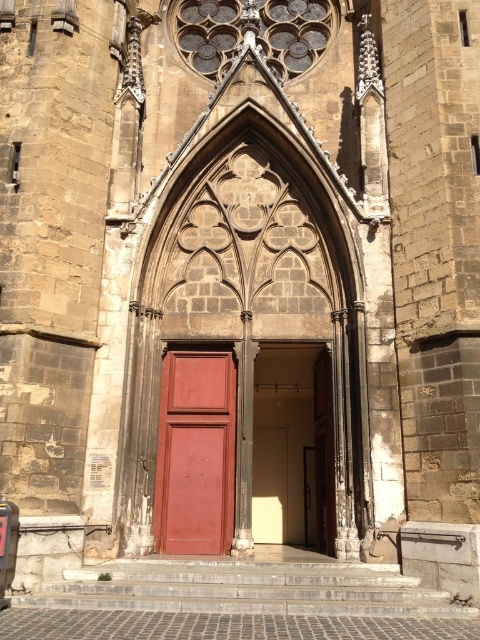
Can you confirm if gray stone stairs at lower center is positioned above matte wood door at center?

No, gray stone stairs at lower center is not above matte wood door at center.

The width and height of the screenshot is (480, 640). In order to click on gray stone stairs at lower center in this screenshot , I will do `click(244, 588)`.

Image resolution: width=480 pixels, height=640 pixels. Find the location of `gray stone stairs at lower center`. gray stone stairs at lower center is located at coordinates (244, 588).

Who is taller, smooth cream door at center or matte wood door at center?

smooth cream door at center

Does point (332, 518) lie behind point (183, 461)?

No, (332, 518) is closer to viewer.

Is point (311, 371) more distant than point (218, 424)?

Yes, it is behind point (218, 424).

The width and height of the screenshot is (480, 640). I want to click on smooth cream door at center, so click(294, 448).

Can you confirm if gray stone stairs at lower center is positioned to the left of smooth cream door at center?

Correct, you'll find gray stone stairs at lower center to the left of smooth cream door at center.

Which is above, gray stone stairs at lower center or smooth cream door at center?

Positioned higher is smooth cream door at center.

The width and height of the screenshot is (480, 640). In order to click on gray stone stairs at lower center in this screenshot , I will do `click(244, 588)`.

The image size is (480, 640). I want to click on gray stone stairs at lower center, so click(x=244, y=588).